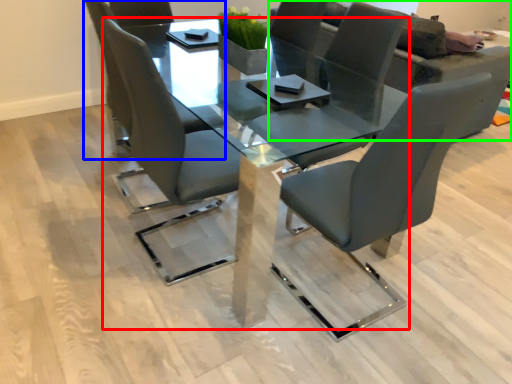
Question: Considering the real-world distances, which object is closest to table (highlighted by a red box)? chair (highlighted by a blue box) or couch (highlighted by a green box).

Choices:
 (A) chair
 (B) couch

Answer: (A)